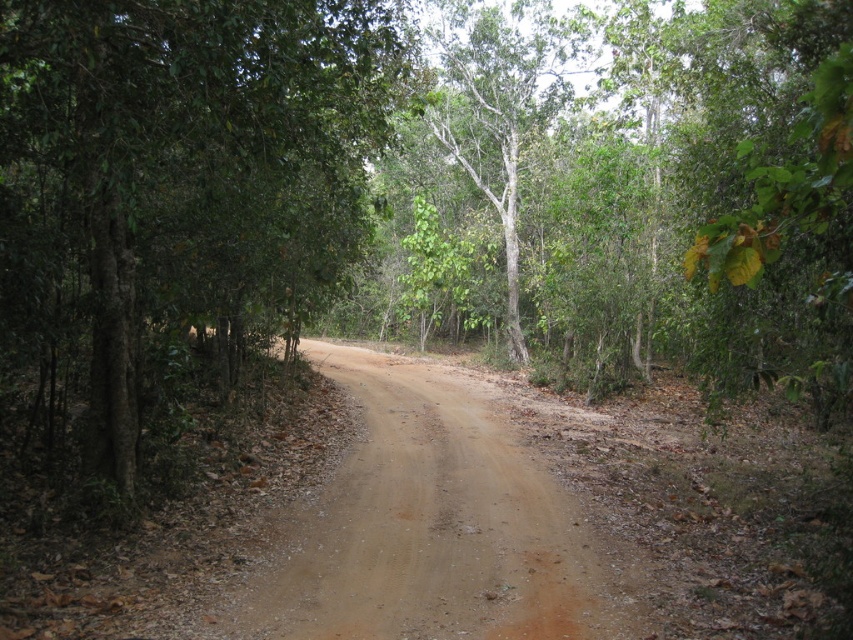
Question: Which is nearer to the green leafy tree at left?

Choices:
 (A) green matte tree at center
 (B) brown dirt track at center

Answer: (B)

Question: Which object is closer to the camera taking this photo?

Choices:
 (A) green matte tree at center
 (B) brown dirt track at center
 (C) green leafy tree at left

Answer: (C)

Question: Is brown dirt track at center wider than green matte tree at center?

Choices:
 (A) no
 (B) yes

Answer: (A)

Question: Estimate the real-world distances between objects in this image. Which object is closer to the green leafy tree at left?

Choices:
 (A) green matte tree at center
 (B) brown dirt track at center

Answer: (B)

Question: Observing the image, what is the correct spatial positioning of green leafy tree at left in reference to brown dirt track at center?

Choices:
 (A) above
 (B) below

Answer: (A)

Question: Where is green leafy tree at left located in relation to green matte tree at center in the image?

Choices:
 (A) right
 (B) left

Answer: (B)